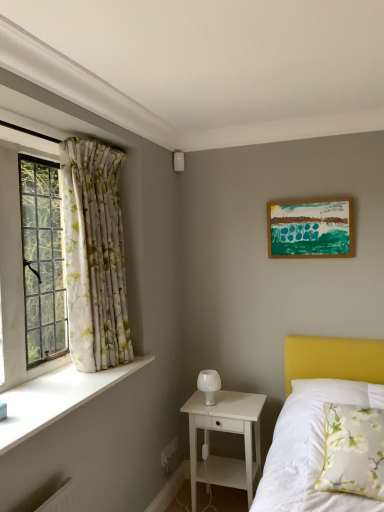
In order to click on free spot below clear glass window at left (from a real-world perspective) in this screenshot , I will do (x=37, y=378).